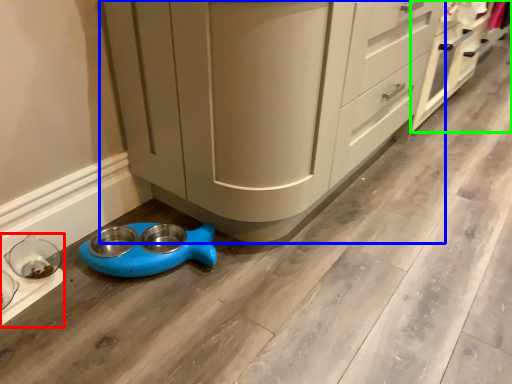
Question: Which is farther away from appliance (highlighted by a red box)? cabinetry (highlighted by a blue box) or cabinetry (highlighted by a green box)?

Choices:
 (A) cabinetry
 (B) cabinetry

Answer: (B)